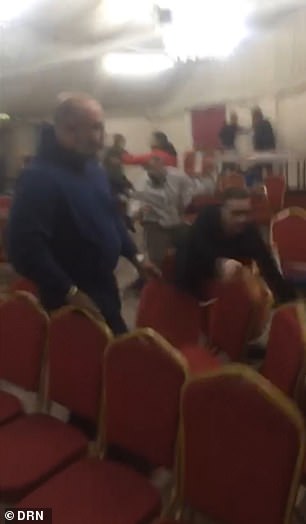
Image resolution: width=306 pixels, height=524 pixels. What are the coordinates of `light` in the screenshot? It's located at (149, 60).